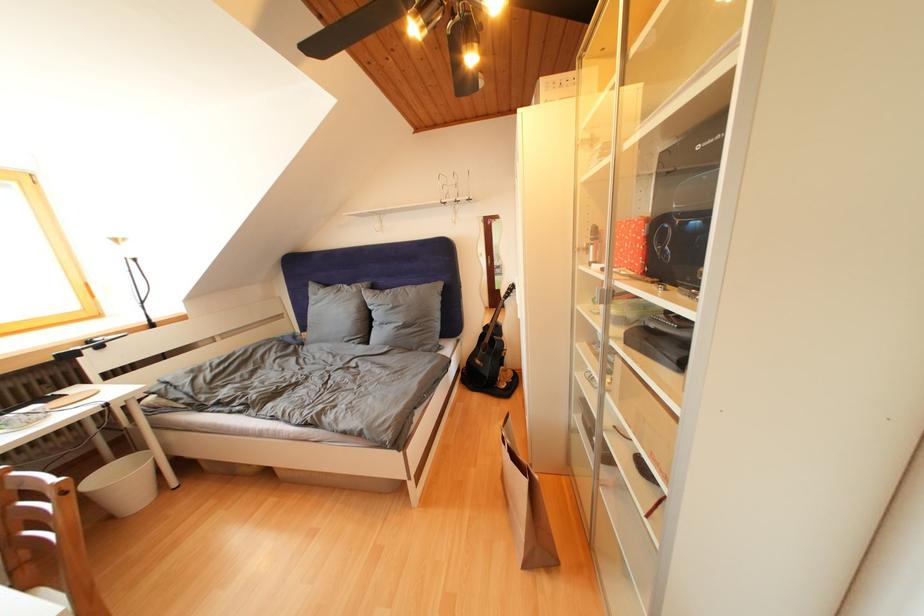
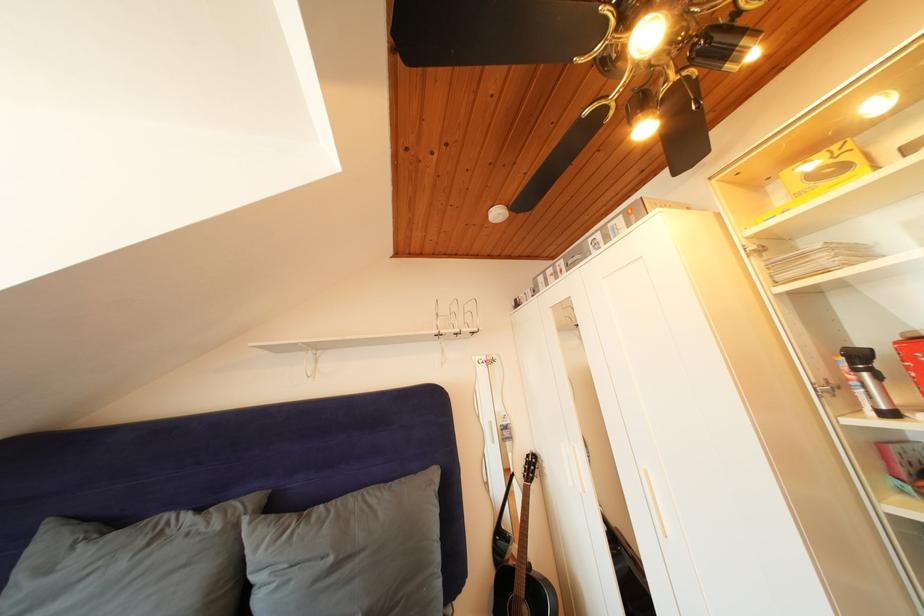
Where in the second image is the point corresponding to the point at 398,310 from the first image?

(338, 565)